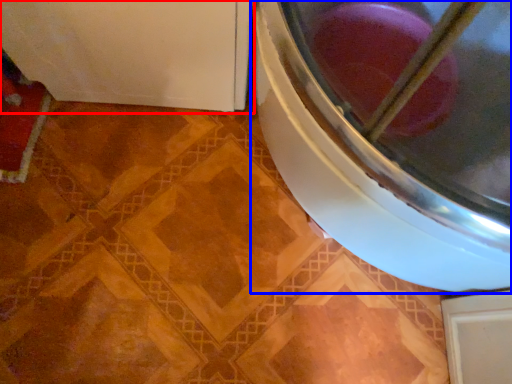
Question: Which object appears farthest to the camera in this image, appliance (highlighted by a red box) or washing machine (highlighted by a blue box)?

Choices:
 (A) appliance
 (B) washing machine

Answer: (A)